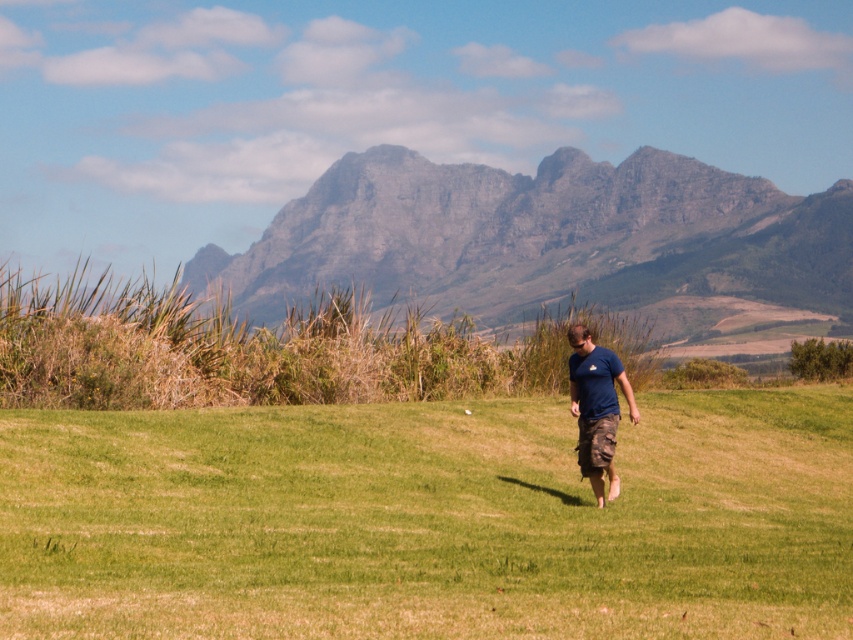
Question: Which point is farther from the camera taking this photo?

Choices:
 (A) (595, 456)
 (B) (531, 252)
 (C) (546, 630)

Answer: (B)

Question: Does green grass at center come in front of blue cotton t-shirt at center?

Choices:
 (A) yes
 (B) no

Answer: (A)

Question: Can you confirm if green grass at center is wider than blue cotton t-shirt at center?

Choices:
 (A) yes
 (B) no

Answer: (A)

Question: Can you confirm if gray rock mountain at center is thinner than blue cotton t-shirt at center?

Choices:
 (A) no
 (B) yes

Answer: (A)

Question: Which point is farther from the camera taking this photo?

Choices:
 (A) (273, 413)
 (B) (592, 465)
 (C) (577, 180)

Answer: (C)

Question: Which point appears closest to the camera in this image?

Choices:
 (A) (474, 291)
 (B) (598, 488)
 (C) (672, 582)

Answer: (C)